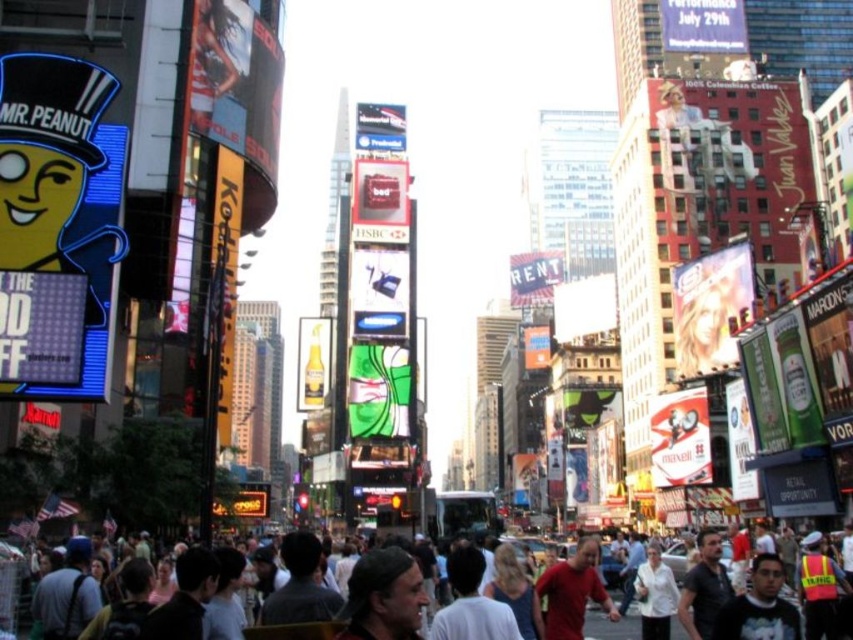
You are a photographer trying to capture a candid shot of two people in the crowd at Times Square. You notice a person wearing a red matte shirt at center and another with blonde hair at center. If you want to frame both subjects in your shot, which subject should you focus on to ensure the wider part of your camera frame accommodates their size?

The red matte shirt at center has a greater width than the blonde hair at center, so focusing on the red matte shirt at center ensures the wider part of your camera frame accommodates its size.

You are a photographer standing in Times Square and see both the dark gray backpack at lower left and the dark brown leather backpack at lower left. Which backpack is smaller in size?

The dark gray backpack at lower left is smaller than the dark brown leather backpack at lower left.